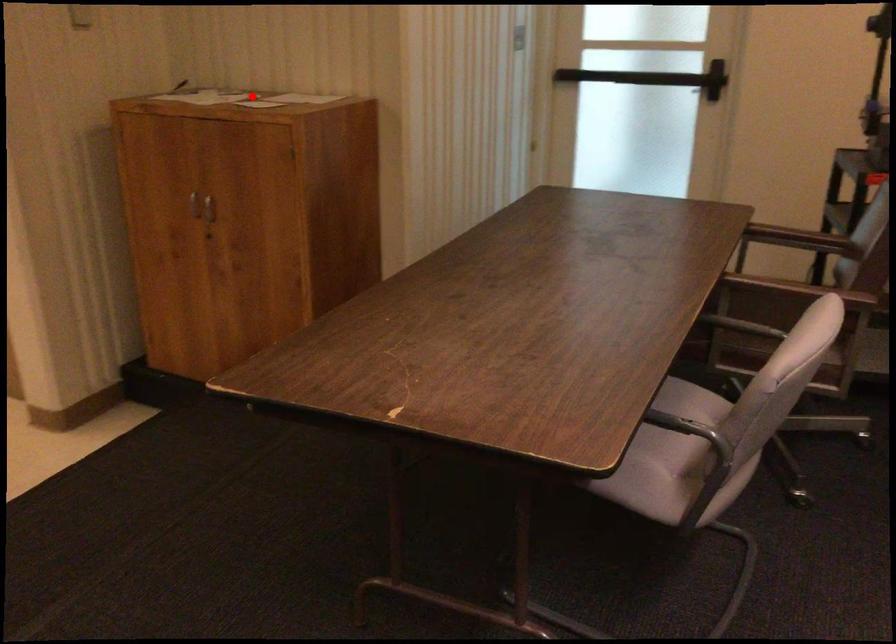
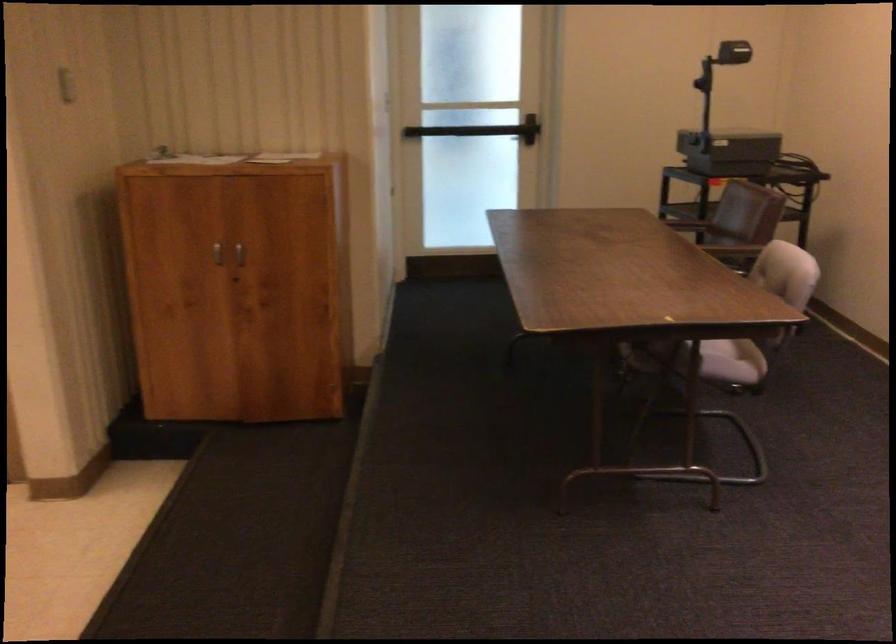
Question: I am providing you with two images of the same scene from different viewpoints. Given a red point in image1, look at the same physical point in image2. Is it:

Choices:
 (A) Closer to the viewpoint
 (B) Farther from the viewpoint

Answer: (B)